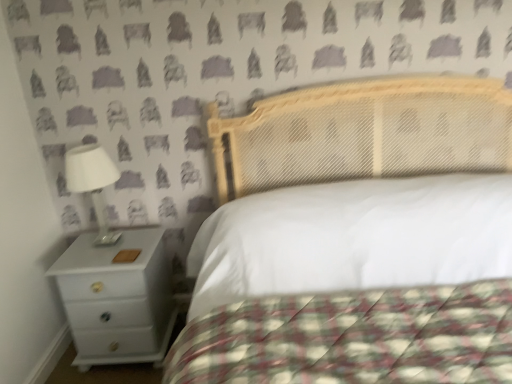
Question: Would you say white glossy nightstand at lower left is a long distance from white quilted fabric at center?

Choices:
 (A) no
 (B) yes

Answer: (A)

Question: Does white glossy nightstand at lower left appear on the left side of white quilted fabric at center?

Choices:
 (A) yes
 (B) no

Answer: (A)

Question: From a real-world perspective, does white glossy nightstand at lower left sit lower than white quilted fabric at center?

Choices:
 (A) no
 (B) yes

Answer: (B)

Question: Is white glossy nightstand at lower left bigger than white quilted fabric at center?

Choices:
 (A) yes
 (B) no

Answer: (B)

Question: Can you confirm if white glossy nightstand at lower left is smaller than white quilted fabric at center?

Choices:
 (A) no
 (B) yes

Answer: (B)

Question: From the image's perspective, is white glossy lamp at left located above or below white glossy nightstand at lower left?

Choices:
 (A) below
 (B) above

Answer: (B)

Question: From a real-world perspective, is white glossy lamp at left physically located above or below white glossy nightstand at lower left?

Choices:
 (A) below
 (B) above

Answer: (B)

Question: In terms of width, does white glossy lamp at left look wider or thinner when compared to white glossy nightstand at lower left?

Choices:
 (A) thin
 (B) wide

Answer: (A)

Question: Based on their sizes in the image, would you say white glossy lamp at left is bigger or smaller than white glossy nightstand at lower left?

Choices:
 (A) small
 (B) big

Answer: (A)

Question: Is white glossy nightstand at lower left taller or shorter than white quilted fabric at center?

Choices:
 (A) short
 (B) tall

Answer: (A)

Question: From the image's perspective, is white glossy nightstand at lower left located above or below white quilted fabric at center?

Choices:
 (A) below
 (B) above

Answer: (A)

Question: In the image, is white glossy nightstand at lower left on the left side or the right side of white quilted fabric at center?

Choices:
 (A) left
 (B) right

Answer: (A)

Question: From a real-world perspective, is white glossy nightstand at lower left positioned above or below white quilted fabric at center?

Choices:
 (A) above
 (B) below

Answer: (B)

Question: From a real-world perspective, is white quilted fabric at center positioned above or below white glossy nightstand at lower left?

Choices:
 (A) below
 (B) above

Answer: (B)

Question: In the image, is white quilted fabric at center positioned in front of or behind white glossy nightstand at lower left?

Choices:
 (A) behind
 (B) front

Answer: (B)